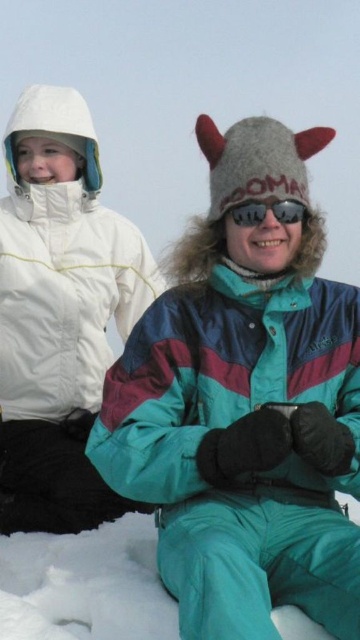
Question: Which object is closer to the camera taking this photo?

Choices:
 (A) white matte jacket at upper left
 (B) sunglasses at center

Answer: (B)

Question: Can you confirm if white matte jacket at upper left is positioned to the left of sunglasses at center?

Choices:
 (A) no
 (B) yes

Answer: (B)

Question: Which point is farther to the camera?

Choices:
 (A) (253, 202)
 (B) (82, 294)

Answer: (B)

Question: Which object appears farthest from the camera in this image?

Choices:
 (A) sunglasses at center
 (B) white matte jacket at upper left

Answer: (B)

Question: Does white matte jacket at upper left appear over sunglasses at center?

Choices:
 (A) yes
 (B) no

Answer: (B)

Question: Observing the image, what is the correct spatial positioning of white matte jacket at upper left in reference to sunglasses at center?

Choices:
 (A) right
 (B) left

Answer: (B)